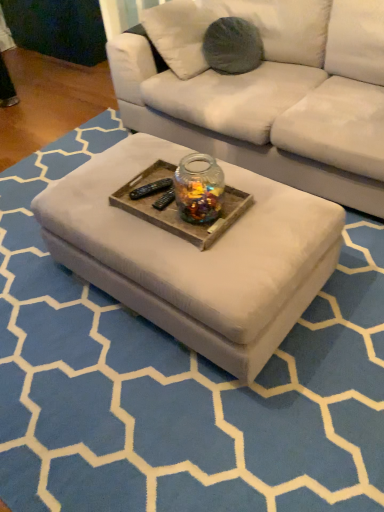
At what (x,y) coordinates should I click in order to perform the action: click on transparent glass jar at center. Please return your answer as a coordinate pair (x, y). Looking at the image, I should click on (199, 188).

I want to click on transparent glass jar at center, so click(199, 188).

Is transparent glass jar at center bigger or smaller than wooden tray at center?

In the image, transparent glass jar at center appears to be larger than wooden tray at center.

From the image's perspective, is transparent glass jar at center located above wooden tray at center?

Yes.

Is transparent glass jar at center at the left side of wooden tray at center?

Incorrect, transparent glass jar at center is not on the left side of wooden tray at center.

Based on the photo, is transparent glass jar at center shorter than wooden tray at center?

No, transparent glass jar at center is not shorter than wooden tray at center.

Which of these two, transparent glass jar at center or white fabric ottoman at center, is smaller?

With smaller size is transparent glass jar at center.

Which is in front, point (179, 177) or point (221, 263)?

The point (221, 263) is closer to the camera.

Would you say transparent glass jar at center is to the left or to the right of white fabric ottoman at center in the picture?

In the image, transparent glass jar at center appears on the right side of white fabric ottoman at center.

Between transparent glass jar at center and white fabric ottoman at center, which one is positioned in front?

white fabric ottoman at center is more forward.

Considering the relative positions of wooden tray at center and white fabric ottoman at center in the image provided, is wooden tray at center to the right of white fabric ottoman at center from the viewer's perspective?

Correct, you'll find wooden tray at center to the right of white fabric ottoman at center.

From a real-world perspective, is wooden tray at center located higher than white fabric ottoman at center?

Yes, from a real-world perspective, wooden tray at center is on top of white fabric ottoman at center.

Are wooden tray at center and white fabric ottoman at center making contact?

No, wooden tray at center is not with white fabric ottoman at center.

Is wooden tray at center not within white fabric ottoman at center?

Yes, wooden tray at center is not within white fabric ottoman at center.

Is white fabric ottoman at center not inside wooden tray at center?

That's correct, white fabric ottoman at center is outside of wooden tray at center.

Between white fabric ottoman at center and wooden tray at center, which one has more height?

white fabric ottoman at center is taller.

From a real-world perspective, does white fabric ottoman at center sit lower than wooden tray at center?

Yes.

Consider the image. Can you confirm if white fabric ottoman at center is thinner than wooden tray at center?

In fact, white fabric ottoman at center might be wider than wooden tray at center.

From the image's perspective, between white fabric ottoman at center and transparent glass jar at center, who is located below?

white fabric ottoman at center.

Are white fabric ottoman at center and transparent glass jar at center beside each other?

No, white fabric ottoman at center is not next to transparent glass jar at center.

Does white fabric ottoman at center contain transparent glass jar at center?

That's incorrect, transparent glass jar at center is not inside white fabric ottoman at center.

Would you say wooden tray at center is outside transparent glass jar at center?

Indeed, wooden tray at center is completely outside transparent glass jar at center.

Which object is closer to the camera, wooden tray at center or transparent glass jar at center?

transparent glass jar at center is more forward.

Based on the photo, is wooden tray at center thinner than transparent glass jar at center?

In fact, wooden tray at center might be wider than transparent glass jar at center.

Is wooden tray at center smaller than transparent glass jar at center?

Yes, wooden tray at center is smaller than transparent glass jar at center.

This screenshot has height=512, width=384. In order to click on glass jar that is above the wooden tray at center (from the image's perspective) in this screenshot , I will do `click(199, 188)`.

Locate an element on the screen. This screenshot has width=384, height=512. coffee table on the left of transparent glass jar at center is located at coordinates (196, 256).

Which object lies further to the anchor point white fabric ottoman at center, transparent glass jar at center or wooden tray at center?

The object further to white fabric ottoman at center is transparent glass jar at center.

Looking at the image, which one is located further to transparent glass jar at center, white fabric ottoman at center or wooden tray at center?

The object further to transparent glass jar at center is white fabric ottoman at center.

From the picture: Looking at the image, which one is located closer to white fabric ottoman at center, wooden tray at center or transparent glass jar at center?

wooden tray at center.

Which object lies nearer to the anchor point wooden tray at center, transparent glass jar at center or white fabric ottoman at center?

Among the two, transparent glass jar at center is located nearer to wooden tray at center.

From the image, which object appears to be farther from transparent glass jar at center, wooden tray at center or white fabric ottoman at center?

white fabric ottoman at center is further to transparent glass jar at center.

Looking at the image, which one is located closer to wooden tray at center, white fabric ottoman at center or transparent glass jar at center?

The object closer to wooden tray at center is transparent glass jar at center.

I want to click on glass jar located between white fabric ottoman at center and wooden tray at center in the depth direction, so click(x=199, y=188).